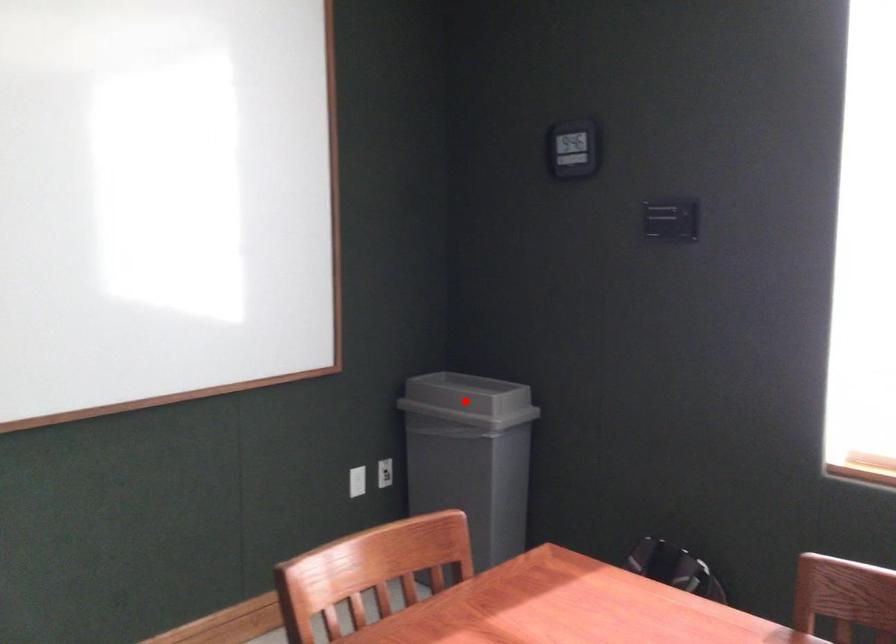
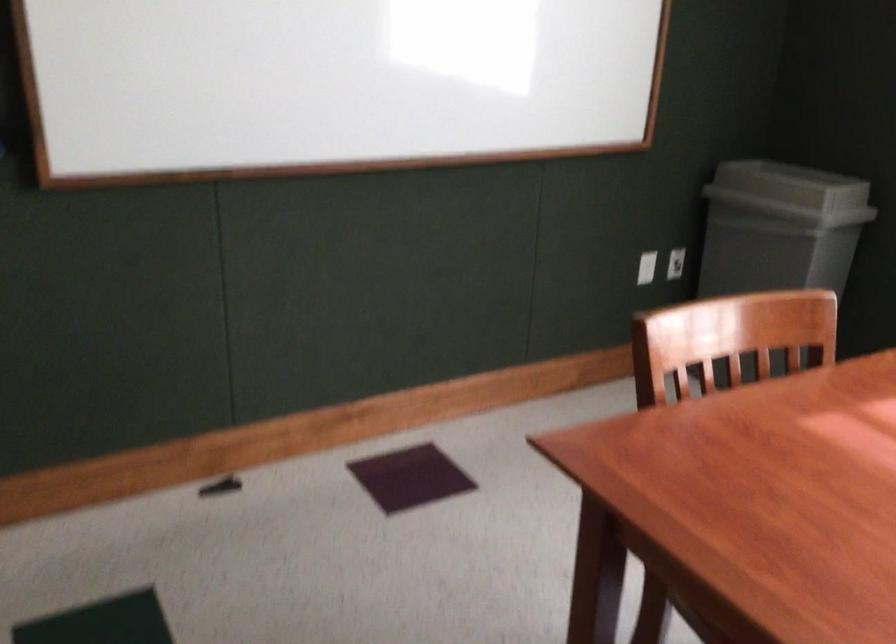
In the second image, find the point that corresponds to the highlighted location in the first image.

(791, 185)